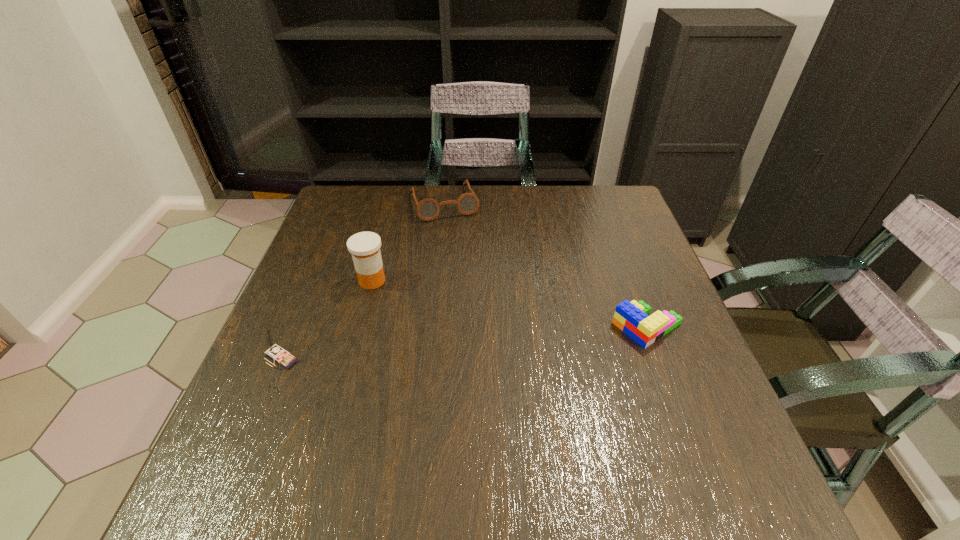
The image size is (960, 540). Find the location of `free space on the desktop that is between the matchbox and the Lego and is positioned on the label of the medicine`. free space on the desktop that is between the matchbox and the Lego and is positioned on the label of the medicine is located at coordinates (446, 343).

In order to click on vacant space on the desktop that is between the leftmost object and the Lego and is positioned on the front-facing side of the second object from right to left in this screenshot , I will do `click(494, 340)`.